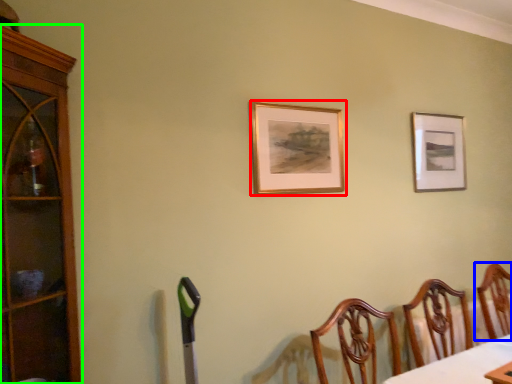
Question: Considering the real-world distances, which object is closest to picture frame (highlighted by a red box)? chair (highlighted by a blue box) or cabinetry (highlighted by a green box).

Choices:
 (A) chair
 (B) cabinetry

Answer: (B)